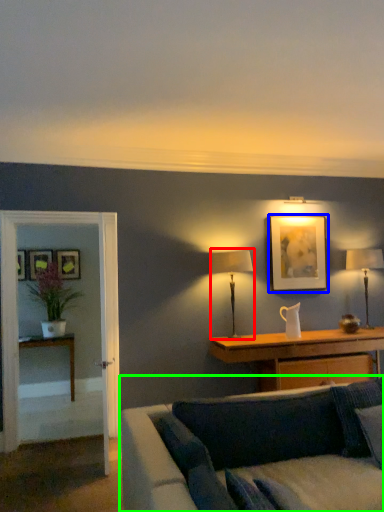
Question: Which object is positioned farthest from table lamp (highlighted by a red box)? Select from picture frame (highlighted by a blue box) and studio couch (highlighted by a green box).

Choices:
 (A) picture frame
 (B) studio couch

Answer: (B)